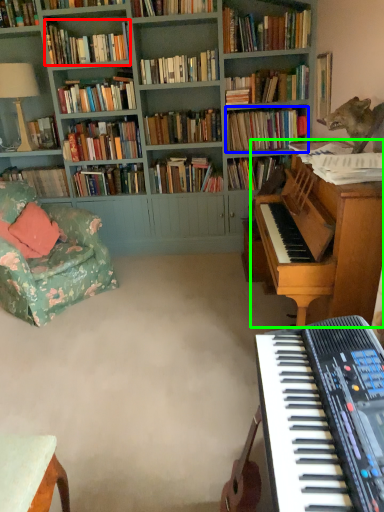
Question: Estimate the real-world distances between objects in this image. Which object is closer to book (highlighted by a red box), book (highlighted by a blue box) or piano (highlighted by a green box)?

Choices:
 (A) book
 (B) piano

Answer: (A)